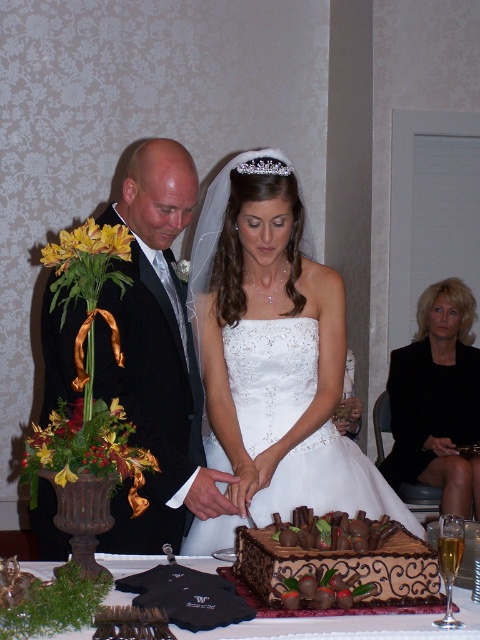
You are a photographer at the wedding and need to frame the white satin dress at center and the clear crystal tiara at upper center in your shot. Which object is wider when viewed from the front?

The white satin dress at center is wider than the clear crystal tiara at upper center.